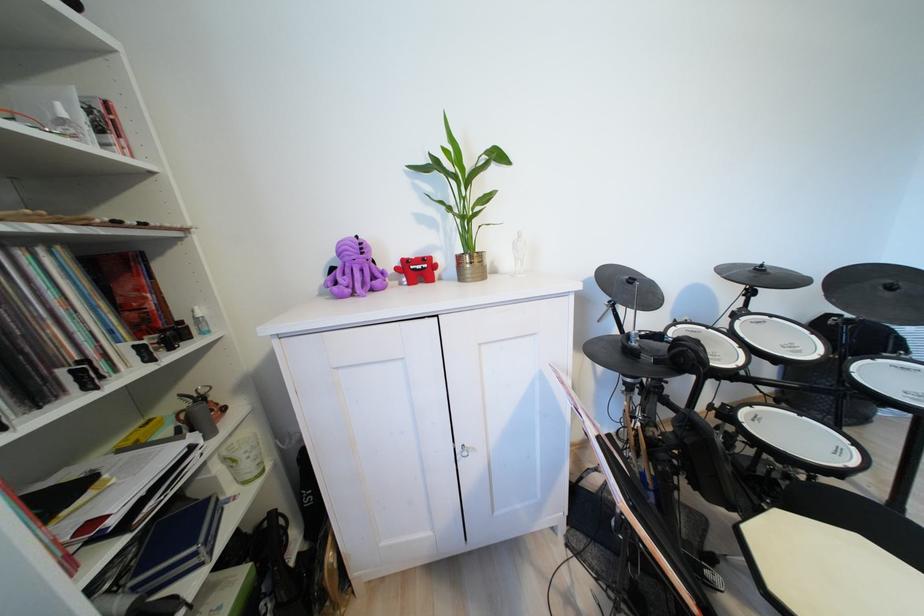
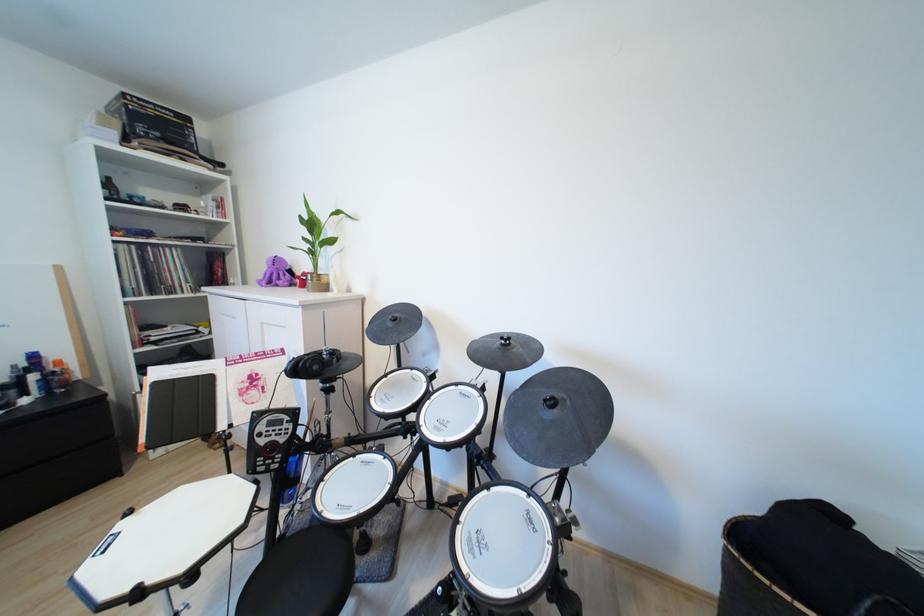
Find the pixel in the second image that matches (360,274) in the first image.

(289, 277)